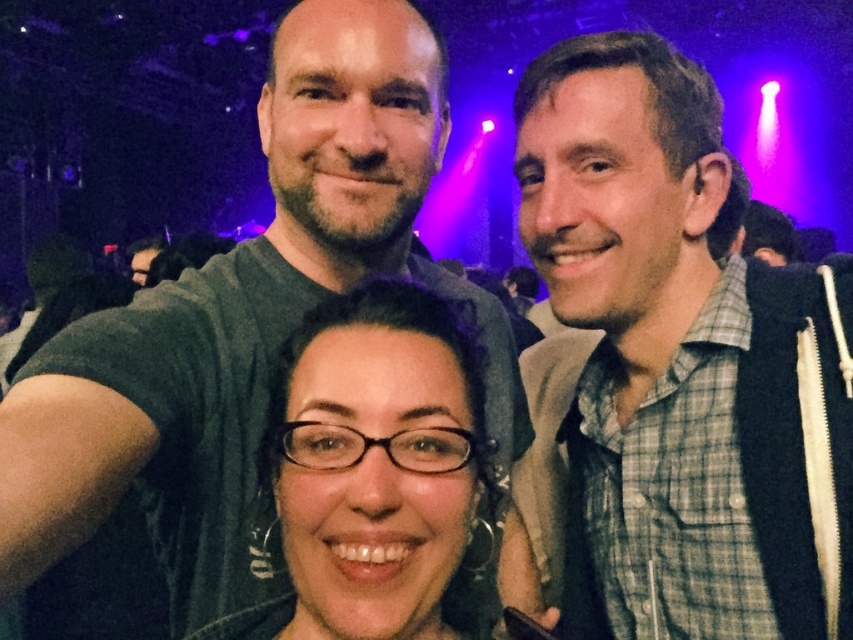
Question: Does green plaid shirt at center appear on the right side of matte black glasses at center?

Choices:
 (A) no
 (B) yes

Answer: (B)

Question: Can you confirm if green plaid shirt at center is thinner than dark gray t-shirt at center?

Choices:
 (A) yes
 (B) no

Answer: (A)

Question: Based on their relative distances, which object is farther from the dark gray t-shirt at center?

Choices:
 (A) matte black glasses at center
 (B) green plaid shirt at center

Answer: (B)

Question: Does green plaid shirt at center have a smaller size compared to dark gray t-shirt at center?

Choices:
 (A) no
 (B) yes

Answer: (B)

Question: Which point appears farthest from the camera in this image?

Choices:
 (A) tap(753, 531)
 (B) tap(85, 476)

Answer: (A)

Question: Which point appears closest to the camera in this image?

Choices:
 (A) (358, 51)
 (B) (457, 353)

Answer: (B)